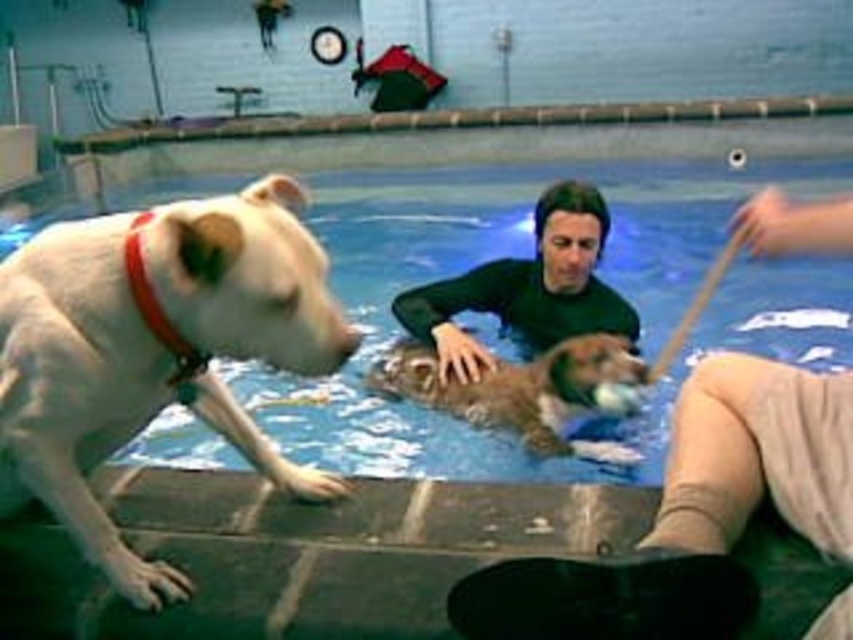
Question: Is white matte dog at left to the right of brown furry dog at center from the viewer's perspective?

Choices:
 (A) yes
 (B) no

Answer: (B)

Question: Which point appears farthest from the camera in this image?

Choices:
 (A) (405, 364)
 (B) (218, 406)

Answer: (A)

Question: Estimate the real-world distances between objects in this image. Which object is farther from the white matte dog at left?

Choices:
 (A) brown furry dog at center
 (B) dark green wetsuit at center

Answer: (B)

Question: Does white matte dog at left have a greater width compared to dark green wetsuit at center?

Choices:
 (A) no
 (B) yes

Answer: (A)

Question: Is white matte dog at left positioned at the back of dark green wetsuit at center?

Choices:
 (A) yes
 (B) no

Answer: (B)

Question: Among these points, which one is nearest to the camera?

Choices:
 (A) (625, 326)
 (B) (26, 424)

Answer: (B)